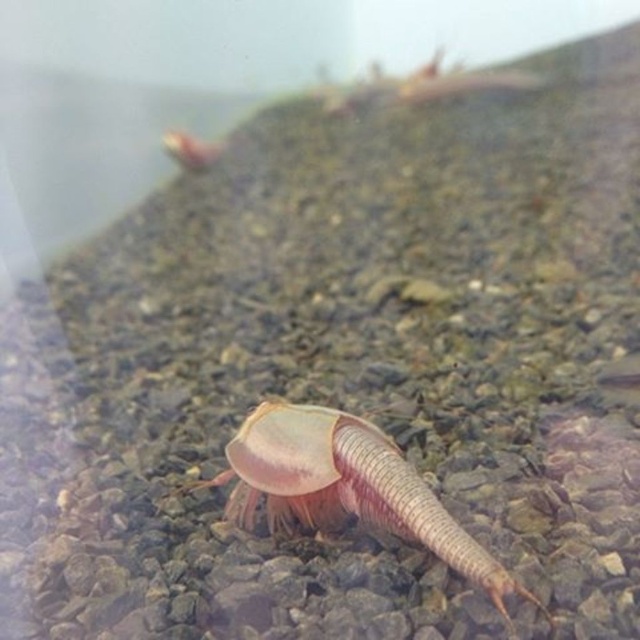
Question: Among these points, which one is nearest to the camera?

Choices:
 (A) (376, 490)
 (B) (209, 163)

Answer: (A)

Question: Is translucent pink exoskeleton at center bigger than translucent pink shrimp at upper left?

Choices:
 (A) yes
 (B) no

Answer: (A)

Question: Can you confirm if translucent pink exoskeleton at center is smaller than translucent pink shrimp at upper left?

Choices:
 (A) yes
 (B) no

Answer: (B)

Question: Which point is closer to the camera?

Choices:
 (A) translucent pink exoskeleton at center
 (B) translucent pink shrimp at upper left

Answer: (A)

Question: Is translucent pink exoskeleton at center to the right of translucent pink shrimp at upper left from the viewer's perspective?

Choices:
 (A) yes
 (B) no

Answer: (A)